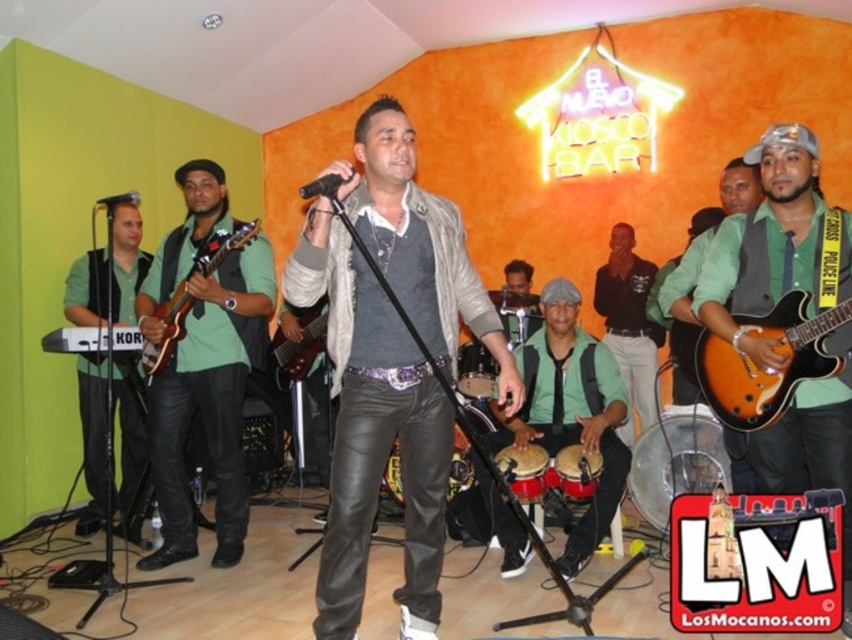
Question: Among these points, which one is nearest to the camera?

Choices:
 (A) (104, 486)
 (B) (117, 202)
 (C) (532, 440)

Answer: (B)

Question: Is matte orange electric guitar at center in front of green matte shirt at center?

Choices:
 (A) no
 (B) yes

Answer: (B)

Question: Among these objects, which one is nearest to the camera?

Choices:
 (A) matte green shirt at center
 (B) black matte microphone at center
 (C) green matte vest at left

Answer: (B)

Question: Can you confirm if matte green shirt at left is bigger than matte brown guitar at center?

Choices:
 (A) yes
 (B) no

Answer: (A)

Question: Is matte orange electric guitar at center bigger than matte green shirt at left?

Choices:
 (A) yes
 (B) no

Answer: (B)

Question: Which point is farther from the camera taking this photo?

Choices:
 (A) (772, 214)
 (B) (384, 209)
 (C) (114, 200)
 (D) (180, 438)

Answer: (D)